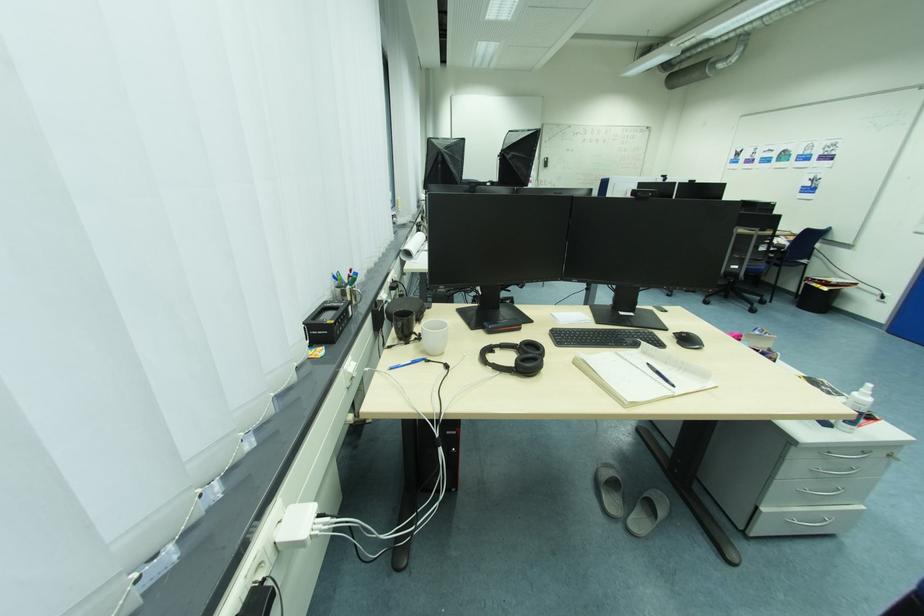
Find the location of a particular element. metal pen holder is located at coordinates [351, 300].